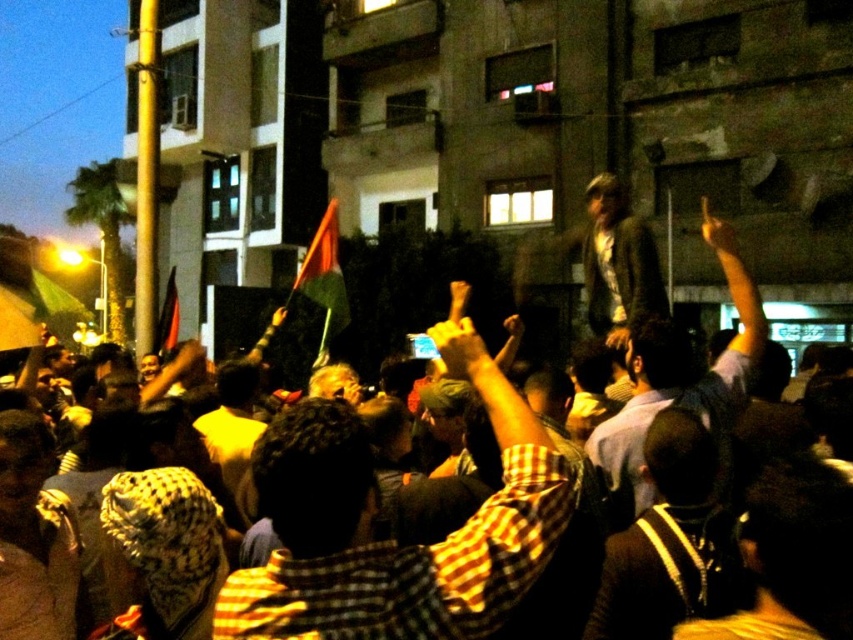
Question: Which point is farther to the camera?

Choices:
 (A) dark brown leather jacket at center
 (B) dark gray jacket at upper center
 (C) checkered shirt at center

Answer: (B)

Question: Which object appears closest to the camera in this image?

Choices:
 (A) dark brown leather jacket at center
 (B) checkered shirt at center

Answer: (B)

Question: Which point is closer to the camera?

Choices:
 (A) dark gray jacket at upper center
 (B) dark brown leather jacket at center
 (C) greenish-gray textured jacket at center

Answer: (B)

Question: Is dark brown leather jacket at center bigger than greenish-gray textured jacket at center?

Choices:
 (A) yes
 (B) no

Answer: (B)

Question: Considering the relative positions of dark brown leather jacket at center and dark gray jacket at upper center in the image provided, where is dark brown leather jacket at center located with respect to dark gray jacket at upper center?

Choices:
 (A) below
 (B) above

Answer: (A)

Question: Does checkered shirt at center appear on the left side of dark brown leather jacket at center?

Choices:
 (A) yes
 (B) no

Answer: (A)